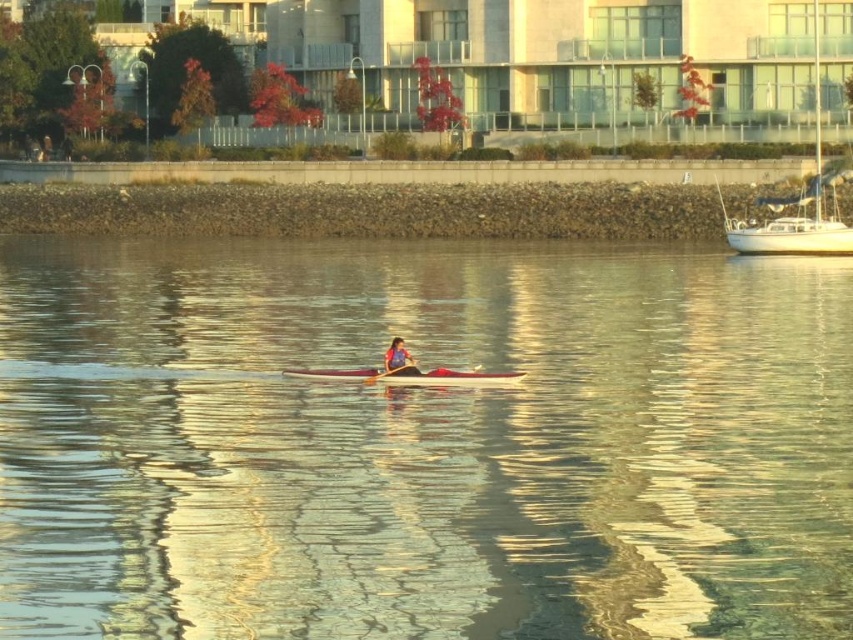
Question: Which object is closer to the camera taking this photo?

Choices:
 (A) blue fabric kayak at center
 (B) wooden paddle at center
 (C) white glossy sailboat at right
 (D) white glossy kayak at center

Answer: (B)

Question: Is white glossy sailboat at right below wooden paddle at center?

Choices:
 (A) no
 (B) yes

Answer: (A)

Question: Is white glossy kayak at center smaller than wooden paddle at center?

Choices:
 (A) no
 (B) yes

Answer: (A)

Question: Considering the real-world distances, which object is farthest from the blue fabric kayak at center?

Choices:
 (A) white glossy kayak at center
 (B) clear water at center

Answer: (B)

Question: Which is nearer to the white glossy sailboat at right?

Choices:
 (A) wooden paddle at center
 (B) clear water at center
 (C) blue fabric kayak at center

Answer: (B)

Question: Is blue fabric kayak at center to the left of wooden paddle at center from the viewer's perspective?

Choices:
 (A) no
 (B) yes

Answer: (A)